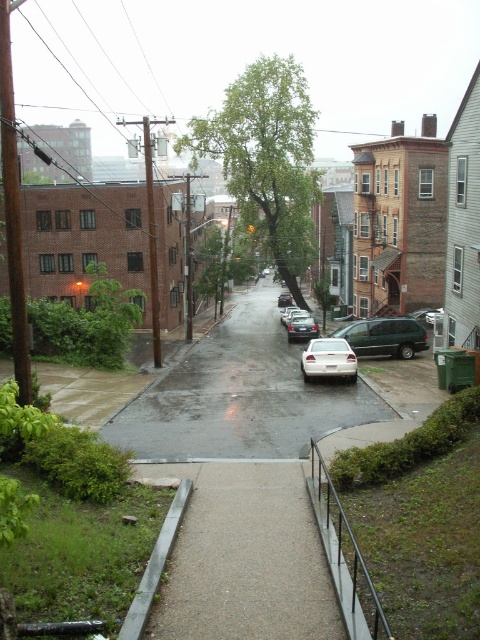
Question: Among these objects, which one is farthest from the camera?

Choices:
 (A) wet asphalt road at center
 (B) green matte van at center
 (C) satin silver sedan at center
 (D) green leafy tree at center

Answer: (D)

Question: Can you confirm if green matte van at center is thinner than white matte car at center?

Choices:
 (A) no
 (B) yes

Answer: (B)

Question: Which point appears farthest from the camera in this image?

Choices:
 (A) (191, 429)
 (B) (304, 339)
 (C) (385, 326)

Answer: (B)

Question: Which object appears closest to the camera in this image?

Choices:
 (A) green leafy tree at center
 (B) white matte sedan at center
 (C) satin silver sedan at center
 (D) green matte van at center

Answer: (B)

Question: Is wet asphalt road at center in front of white matte sedan at center?

Choices:
 (A) yes
 (B) no

Answer: (A)

Question: Is gray concrete curb at lower left to the left of white matte car at center from the viewer's perspective?

Choices:
 (A) yes
 (B) no

Answer: (A)